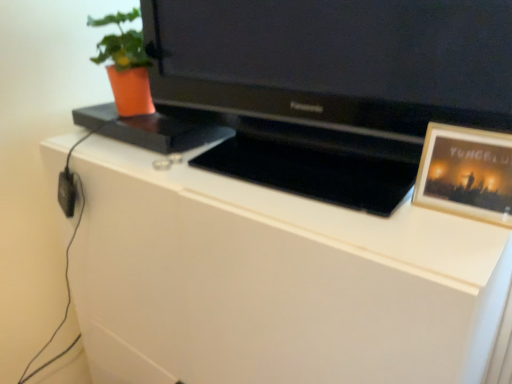
The width and height of the screenshot is (512, 384). What do you see at coordinates (336, 61) in the screenshot?
I see `black glossy television at center` at bounding box center [336, 61].

Measure the distance between point (434, 126) and camera.

They are 71.00 centimeters apart.

Describe the element at coordinates (125, 65) in the screenshot. I see `orange matte pot at upper left` at that location.

You are a GUI agent. You are given a task and a screenshot of the screen. Output one action in this format:
    pyautogui.click(x=<x>, y=<y>)
    Task: Click on the black glossy television at center
    The width and height of the screenshot is (512, 384).
    Given the screenshot: What is the action you would take?
    pyautogui.click(x=336, y=61)

Where is `houseplant above the black glossy television at center (from a real-world perspective)`? houseplant above the black glossy television at center (from a real-world perspective) is located at coordinates (125, 65).

Visually, is black glossy television at center positioned to the left or to the right of orange matte pot at upper left?

black glossy television at center is to the right of orange matte pot at upper left.

Relative to orange matte pot at upper left, is black glossy television at center in front or behind?

black glossy television at center is in front of orange matte pot at upper left.

Is black glossy television at center bigger than orange matte pot at upper left?

Indeed, black glossy television at center has a larger size compared to orange matte pot at upper left.

Is point (207, 328) positioned after point (473, 172)?

Yes, point (207, 328) is behind point (473, 172).

How much distance is there between white matte cabinet at center and gold-framed photo at upper right?

white matte cabinet at center is 43.72 centimeters from gold-framed photo at upper right.

Does white matte cabinet at center have a lesser height compared to gold-framed photo at upper right?

In fact, white matte cabinet at center may be taller than gold-framed photo at upper right.

Which of these two, white matte cabinet at center or gold-framed photo at upper right, is bigger?

With larger size is white matte cabinet at center.

From a real-world perspective, relative to gold-framed photo at upper right, is black glossy television at center vertically above or below?

black glossy television at center is above gold-framed photo at upper right.

From the image's perspective, between black glossy television at center and gold-framed photo at upper right, which one is located above?

black glossy television at center.

Locate an element on the screen. The image size is (512, 384). picture frame to the right of black glossy television at center is located at coordinates (466, 173).

Who is taller, black glossy television at center or gold-framed photo at upper right?

Standing taller between the two is black glossy television at center.

From a real-world perspective, is orange matte pot at upper left physically located above or below gold-framed photo at upper right?

From a real-world perspective, orange matte pot at upper left is physically above gold-framed photo at upper right.

Based on the photo, is orange matte pot at upper left wider than gold-framed photo at upper right?

Yes, orange matte pot at upper left is wider than gold-framed photo at upper right.

Is orange matte pot at upper left not close to gold-framed photo at upper right?

No, there isn't a large distance between orange matte pot at upper left and gold-framed photo at upper right.

Considering the relative sizes of gold-framed photo at upper right and orange matte pot at upper left in the image provided, is gold-framed photo at upper right thinner than orange matte pot at upper left?

Yes.

Is orange matte pot at upper left located within gold-framed photo at upper right?

That's incorrect, orange matte pot at upper left is not inside gold-framed photo at upper right.

Is gold-framed photo at upper right taller than orange matte pot at upper left?

Incorrect, the height of gold-framed photo at upper right is not larger of that of orange matte pot at upper left.

Which is behind, gold-framed photo at upper right or white matte cabinet at center?

gold-framed photo at upper right is behind.

Is white matte cabinet at center at the back of gold-framed photo at upper right?

No, white matte cabinet at center is not at the back of gold-framed photo at upper right.

Is gold-framed photo at upper right placed right next to white matte cabinet at center?

No, gold-framed photo at upper right is not making contact with white matte cabinet at center.

Between gold-framed photo at upper right and black glossy television at center, which one is positioned behind?

Positioned behind is gold-framed photo at upper right.

Is black glossy television at center located within gold-framed photo at upper right?

Actually, black glossy television at center is outside gold-framed photo at upper right.

Which point is more forward, (432, 189) or (451, 16)?

The point (451, 16) is closer.

Is gold-framed photo at upper right beside black glossy television at center?

No, gold-framed photo at upper right is not beside black glossy television at center.

Locate an element on the screen. houseplant above the black glossy television at center (from a real-world perspective) is located at coordinates (x=125, y=65).

The height and width of the screenshot is (384, 512). Identify the location of picture frame located above the white matte cabinet at center (from the image's perspective). (466, 173).

When comparing their distances from black glossy television at center, does white matte cabinet at center or gold-framed photo at upper right seem closer?

gold-framed photo at upper right.

Looking at the image, which one is located further to orange matte pot at upper left, white matte cabinet at center or black glossy television at center?

white matte cabinet at center is further to orange matte pot at upper left.

Looking at the image, which one is located closer to white matte cabinet at center, orange matte pot at upper left or black glossy television at center?

black glossy television at center.

Looking at the image, which one is located further to orange matte pot at upper left, white matte cabinet at center or gold-framed photo at upper right?

gold-framed photo at upper right is further to orange matte pot at upper left.

Considering their positions, is black glossy television at center positioned further to gold-framed photo at upper right than white matte cabinet at center?

white matte cabinet at center is positioned further to the anchor gold-framed photo at upper right.

Based on their spatial positions, is orange matte pot at upper left or black glossy television at center closer to gold-framed photo at upper right?

black glossy television at center is closer to gold-framed photo at upper right.

From the picture: Looking at the image, which one is located further to orange matte pot at upper left, black glossy television at center or gold-framed photo at upper right?

The object further to orange matte pot at upper left is gold-framed photo at upper right.

Looking at the image, which one is located further to orange matte pot at upper left, gold-framed photo at upper right or black glossy television at center?

gold-framed photo at upper right.

I want to click on television situated between orange matte pot at upper left and gold-framed photo at upper right from left to right, so click(x=336, y=61).

Locate an element on the screen. television between orange matte pot at upper left and white matte cabinet at center in the vertical direction is located at coordinates (336, 61).

Where is `picture frame between black glossy television at center and white matte cabinet at center vertically`? The image size is (512, 384). picture frame between black glossy television at center and white matte cabinet at center vertically is located at coordinates (466, 173).

Image resolution: width=512 pixels, height=384 pixels. Identify the location of picture frame between orange matte pot at upper left and white matte cabinet at center vertically. (466, 173).